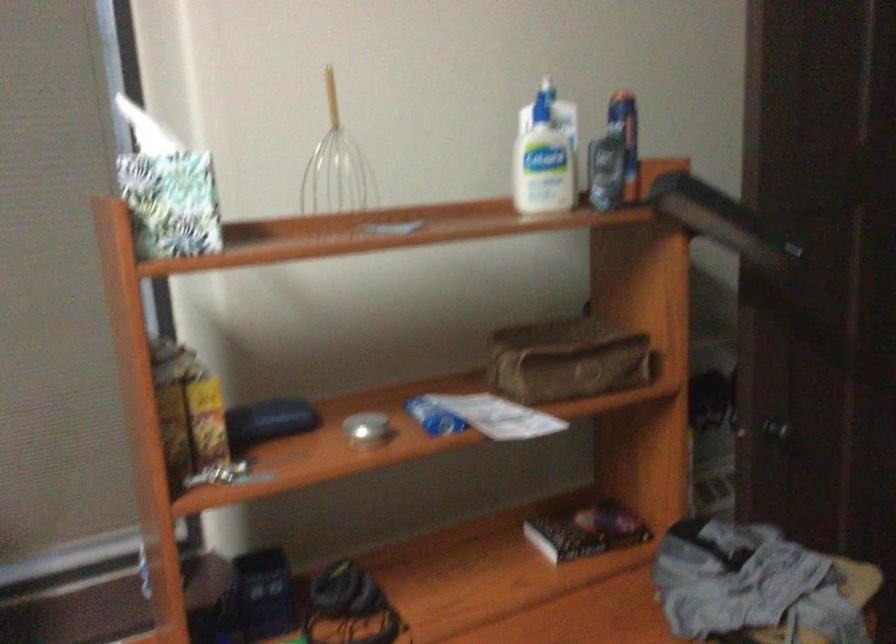
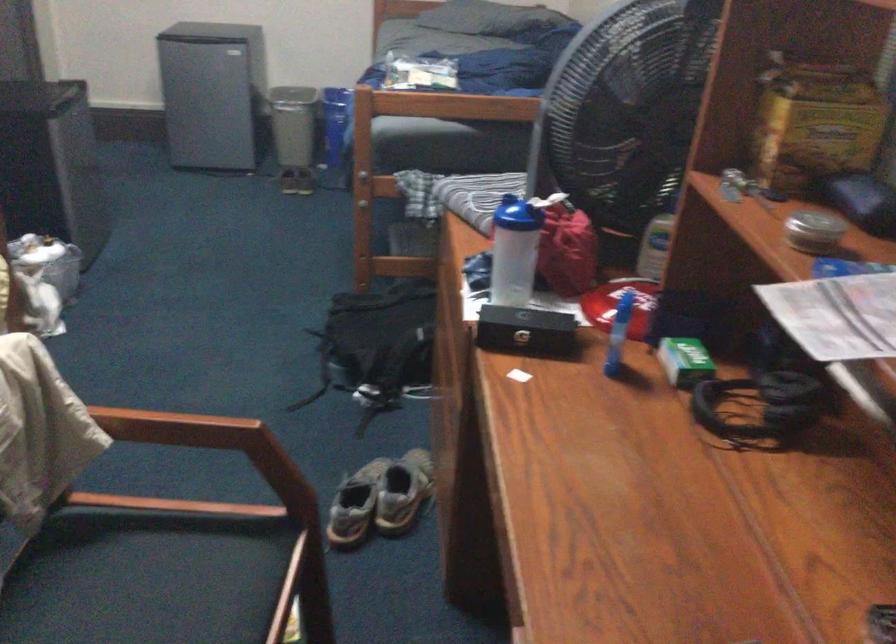
In the second image, find the point that corresponds to pixel 188 393 in the first image.

(814, 124)